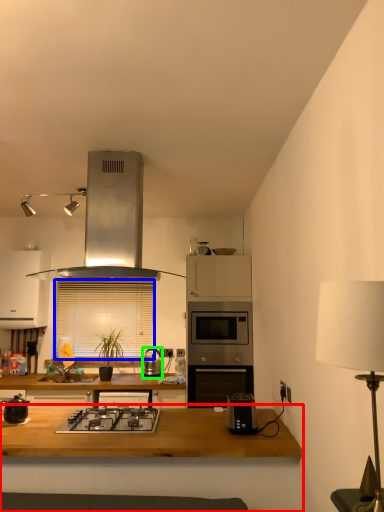
Question: Considering the real-world distances, which object is closest to table (highlighted by a red box)? window screen (highlighted by a blue box) or kitchen appliance (highlighted by a green box).

Choices:
 (A) window screen
 (B) kitchen appliance

Answer: (B)